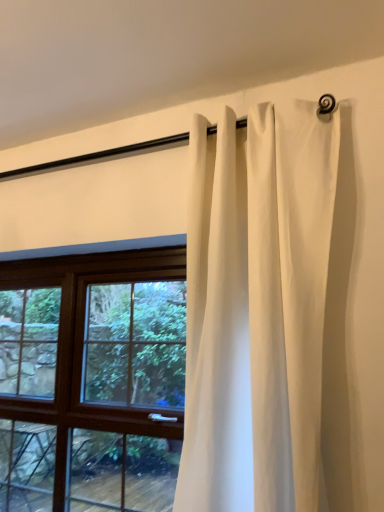
Question: Would you say white cotton curtain at upper center is to the left or to the right of brown wooden window at center in the picture?

Choices:
 (A) left
 (B) right

Answer: (B)

Question: Choose the correct answer: Is white cotton curtain at upper center inside brown wooden window at center or outside it?

Choices:
 (A) outside
 (B) inside

Answer: (A)

Question: In terms of size, does white cotton curtain at upper center appear bigger or smaller than brown wooden window at center?

Choices:
 (A) big
 (B) small

Answer: (A)

Question: Is brown wooden window at center taller or shorter than white cotton curtain at upper center?

Choices:
 (A) short
 (B) tall

Answer: (A)

Question: Is point (19, 444) closer or farther from the camera than point (299, 285)?

Choices:
 (A) farther
 (B) closer

Answer: (A)

Question: Would you say brown wooden window at center is inside or outside white cotton curtain at upper center?

Choices:
 (A) outside
 (B) inside

Answer: (A)

Question: In terms of size, does brown wooden window at center appear bigger or smaller than white cotton curtain at upper center?

Choices:
 (A) big
 (B) small

Answer: (B)